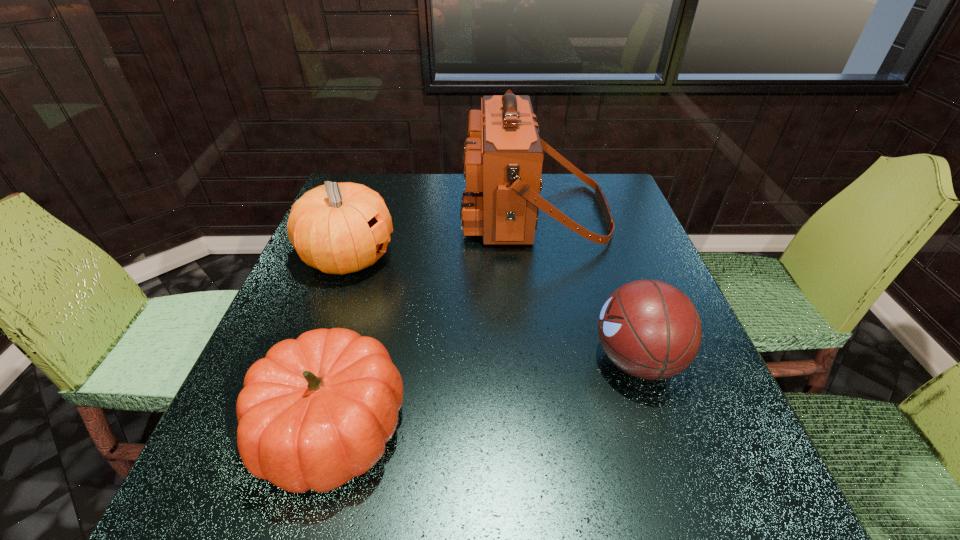
Identify the location of vacant space that satisfies the following two spatial constraints: 1. on the front-facing side of the second tallest object; 2. on the left side of the shorter pumpkin. (287, 428).

The image size is (960, 540). Find the location of `free location that satisfies the following two spatial constraints: 1. on the front-facing side of the second tallest object; 2. on the right side of the shorter pumpkin`. free location that satisfies the following two spatial constraints: 1. on the front-facing side of the second tallest object; 2. on the right side of the shorter pumpkin is located at coordinates (287, 428).

This screenshot has height=540, width=960. I want to click on vacant region that satisfies the following two spatial constraints: 1. on the front-facing side of the taller pumpkin; 2. on the left side of the nearer pumpkin, so pyautogui.click(x=287, y=428).